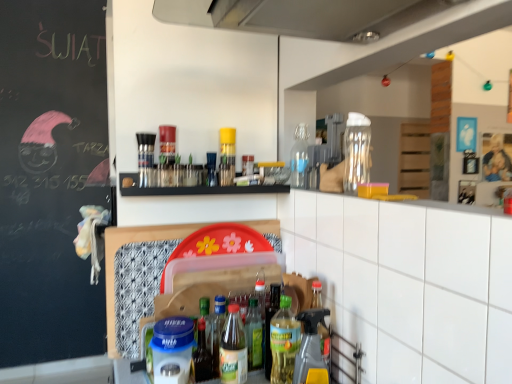
Question: Is translucent plastic spray bottle at lower center, the 9th bottle when ordered from left to right, inside the boundaries of translucent plastic bottle at center, the tenth bottle from the right, or outside?

Choices:
 (A) inside
 (B) outside

Answer: (B)

Question: Is point [x=321, y=354] closer or farther from the camera than point [x=197, y=365]?

Choices:
 (A) closer
 (B) farther

Answer: (A)

Question: Estimate the real-world distances between objects in this image. Which object is closer to the translucent plastic bottle at center, which is counted as the fifth bottle, starting from the left?

Choices:
 (A) translucent glass bottle at center, the first bottle from the left
 (B) green glass bottle at center, which ranks as the fifth bottle in right-to-left order
 (C) transparent glass bottle at upper center, which is counted as the tenth bottle, starting from the left
 (D) green glass bottle at center, the fourth bottle viewed from the right
 (E) translucent glass bottle at center, the 6th bottle when ordered from left to right

Answer: (B)

Question: Based on their relative distances, which object is farther from the translucent plastic bottle at center, the eighth bottle in the right-to-left sequence?

Choices:
 (A) translucent plastic bottle at center, the ninth bottle in the right-to-left sequence
 (B) translucent plastic bottle at center, which is counted as the fifth bottle, starting from the left
 (C) green glass bottle at center, the fourth bottle viewed from the right
 (D) translucent plastic bottle at center, the tenth bottle from the right
 (E) transparent glass bottle at upper center, which is counted as the tenth bottle, starting from the left

Answer: (E)